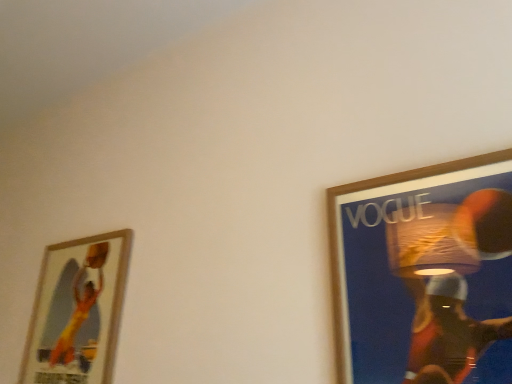
Locate an element on the screen. The height and width of the screenshot is (384, 512). wooden picture frame at upper right, which is the first picture frame in front-to-back order is located at coordinates (425, 274).

The image size is (512, 384). Describe the element at coordinates (425, 274) in the screenshot. I see `wooden picture frame at upper right, which is the first picture frame in front-to-back order` at that location.

How much space does wooden picture frame at upper right, the second picture frame in the back-to-front sequence, occupy vertically?

The height of wooden picture frame at upper right, the second picture frame in the back-to-front sequence, is 17.45 inches.

Where is `wooden framed poster at left, which ranks as the second picture frame in front-to-back order`? wooden framed poster at left, which ranks as the second picture frame in front-to-back order is located at coordinates (77, 311).

This screenshot has width=512, height=384. What do you see at coordinates (77, 311) in the screenshot?
I see `wooden framed poster at left, the first picture frame viewed from the back` at bounding box center [77, 311].

Locate an element on the screen. Image resolution: width=512 pixels, height=384 pixels. wooden picture frame at upper right, which is the first picture frame in front-to-back order is located at coordinates (425, 274).

Which object is positioned more to the right, wooden framed poster at left, which ranks as the second picture frame in front-to-back order, or wooden picture frame at upper right, the second picture frame in the back-to-front sequence?

wooden picture frame at upper right, the second picture frame in the back-to-front sequence, is more to the right.

Considering the positions of objects wooden framed poster at left, which ranks as the second picture frame in front-to-back order, and wooden picture frame at upper right, the 2th picture frame from the left, in the image provided, who is behind, wooden framed poster at left, which ranks as the second picture frame in front-to-back order, or wooden picture frame at upper right, the 2th picture frame from the left,?

wooden framed poster at left, which ranks as the second picture frame in front-to-back order, is further away from the camera.

In the scene shown: Which is closer to the camera, (95,381) or (344,219)?

Point (95,381) appears to be farther away from the viewer than point (344,219).

From the image's perspective, is wooden framed poster at left, which ranks as the second picture frame in front-to-back order, below wooden picture frame at upper right, the 2th picture frame from the left?

Indeed, from the image's perspective, wooden framed poster at left, which ranks as the second picture frame in front-to-back order, is shown beneath wooden picture frame at upper right, the 2th picture frame from the left.

From a real-world perspective, is wooden framed poster at left, the first picture frame viewed from the back, physically below wooden picture frame at upper right, which is the first picture frame in front-to-back order?

No, from a real-world perspective, wooden framed poster at left, the first picture frame viewed from the back, is not beneath wooden picture frame at upper right, which is the first picture frame in front-to-back order.

In terms of width, does wooden framed poster at left, which ranks as the second picture frame in front-to-back order, look wider or thinner when compared to wooden picture frame at upper right, which is the first picture frame in front-to-back order?

wooden framed poster at left, which ranks as the second picture frame in front-to-back order, is wider than wooden picture frame at upper right, which is the first picture frame in front-to-back order.

Considering the relative sizes of wooden framed poster at left, the first picture frame viewed from the back, and wooden picture frame at upper right, the second picture frame in the back-to-front sequence, in the image provided, is wooden framed poster at left, the first picture frame viewed from the back, taller than wooden picture frame at upper right, the second picture frame in the back-to-front sequence,?

Indeed, wooden framed poster at left, the first picture frame viewed from the back, has a greater height compared to wooden picture frame at upper right, the second picture frame in the back-to-front sequence.

Considering the sizes of objects wooden framed poster at left, the second picture frame in the right-to-left sequence, and wooden picture frame at upper right, arranged as the first picture frame when viewed from the right, in the image provided, who is bigger, wooden framed poster at left, the second picture frame in the right-to-left sequence, or wooden picture frame at upper right, arranged as the first picture frame when viewed from the right,?

With larger size is wooden framed poster at left, the second picture frame in the right-to-left sequence.

Would you say wooden framed poster at left, which is the first picture frame in left-to-right order, is outside wooden picture frame at upper right, arranged as the first picture frame when viewed from the right?

Yes, wooden framed poster at left, which is the first picture frame in left-to-right order, is not within wooden picture frame at upper right, arranged as the first picture frame when viewed from the right.

Is wooden framed poster at left, which ranks as the second picture frame in front-to-back order, positioned far away from wooden picture frame at upper right, the second picture frame in the back-to-front sequence?

wooden framed poster at left, which ranks as the second picture frame in front-to-back order, is near wooden picture frame at upper right, the second picture frame in the back-to-front sequence, not far away.

Is wooden framed poster at left, which is the first picture frame in left-to-right order, turned away from wooden picture frame at upper right, arranged as the first picture frame when viewed from the right?

No, wooden framed poster at left, which is the first picture frame in left-to-right order, is not facing away from wooden picture frame at upper right, arranged as the first picture frame when viewed from the right.

Could you measure the distance between wooden framed poster at left, which is the first picture frame in left-to-right order, and wooden picture frame at upper right, the 2th picture frame from the left?

The distance of wooden framed poster at left, which is the first picture frame in left-to-right order, from wooden picture frame at upper right, the 2th picture frame from the left, is 26.17 inches.

Locate an element on the screen. Image resolution: width=512 pixels, height=384 pixels. picture frame below the wooden picture frame at upper right, arranged as the first picture frame when viewed from the right (from the image's perspective) is located at coordinates (77, 311).

Considering the positions of objects wooden picture frame at upper right, the second picture frame in the back-to-front sequence, and wooden framed poster at left, the second picture frame in the right-to-left sequence, in the image provided, who is more to the right, wooden picture frame at upper right, the second picture frame in the back-to-front sequence, or wooden framed poster at left, the second picture frame in the right-to-left sequence,?

wooden picture frame at upper right, the second picture frame in the back-to-front sequence.

Which object is further away from the camera, wooden picture frame at upper right, the second picture frame in the back-to-front sequence, or wooden framed poster at left, the second picture frame in the right-to-left sequence?

wooden framed poster at left, the second picture frame in the right-to-left sequence.

Which is nearer, [448,359] or [79,263]?

Point [448,359] is closer to the camera than point [79,263].

From the image's perspective, which is above, wooden picture frame at upper right, the 2th picture frame from the left, or wooden framed poster at left, which is the first picture frame in left-to-right order?

wooden picture frame at upper right, the 2th picture frame from the left.

From a real-world perspective, relative to wooden framed poster at left, which ranks as the second picture frame in front-to-back order, is wooden picture frame at upper right, which is the first picture frame in front-to-back order, vertically above or below?

From a real-world perspective, wooden picture frame at upper right, which is the first picture frame in front-to-back order, is physically below wooden framed poster at left, which ranks as the second picture frame in front-to-back order.

Does wooden picture frame at upper right, the 2th picture frame from the left, have a greater width compared to wooden framed poster at left, the first picture frame viewed from the back?

No, wooden picture frame at upper right, the 2th picture frame from the left, is not wider than wooden framed poster at left, the first picture frame viewed from the back.

Is wooden picture frame at upper right, the second picture frame in the back-to-front sequence, taller or shorter than wooden framed poster at left, the first picture frame viewed from the back?

Clearly, wooden picture frame at upper right, the second picture frame in the back-to-front sequence, is shorter compared to wooden framed poster at left, the first picture frame viewed from the back.

Is wooden picture frame at upper right, the second picture frame in the back-to-front sequence, bigger or smaller than wooden framed poster at left, the first picture frame viewed from the back?

wooden picture frame at upper right, the second picture frame in the back-to-front sequence, is smaller than wooden framed poster at left, the first picture frame viewed from the back.

Is wooden framed poster at left, the first picture frame viewed from the back, located within wooden picture frame at upper right, arranged as the first picture frame when viewed from the right?

No, wooden framed poster at left, the first picture frame viewed from the back, is not surrounded by wooden picture frame at upper right, arranged as the first picture frame when viewed from the right.

Are wooden picture frame at upper right, the second picture frame in the back-to-front sequence, and wooden framed poster at left, the first picture frame viewed from the back, located far from each other?

They are positioned close to each other.

Does wooden picture frame at upper right, the 2th picture frame from the left, turn towards wooden framed poster at left, which is the first picture frame in left-to-right order?

No, wooden picture frame at upper right, the 2th picture frame from the left, is not aimed at wooden framed poster at left, which is the first picture frame in left-to-right order.

What's the angular difference between wooden picture frame at upper right, the 2th picture frame from the left, and wooden framed poster at left, which ranks as the second picture frame in front-to-back order,'s facing directions?

There is a 2.28-degree angle between the facing directions of wooden picture frame at upper right, the 2th picture frame from the left, and wooden framed poster at left, which ranks as the second picture frame in front-to-back order.

Locate an element on the screen. picture frame above the wooden framed poster at left, which is the first picture frame in left-to-right order (from the image's perspective) is located at coordinates (425, 274).

Where is `picture frame above the wooden framed poster at left, which ranks as the second picture frame in front-to-back order (from the image's perspective)`? The width and height of the screenshot is (512, 384). picture frame above the wooden framed poster at left, which ranks as the second picture frame in front-to-back order (from the image's perspective) is located at coordinates (425, 274).

I want to click on picture frame above the wooden picture frame at upper right, the 2th picture frame from the left (from a real-world perspective), so coord(77,311).